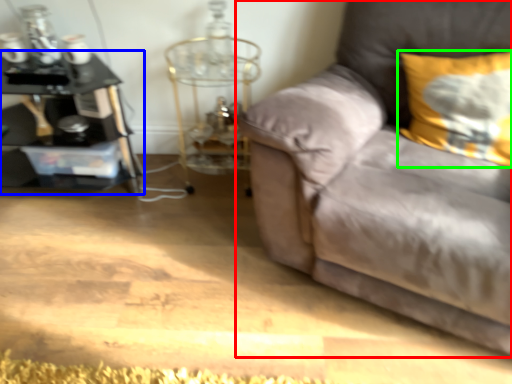
Question: Estimate the real-world distances between objects in this image. Which object is farther from studio couch (highlighted by a red box), table (highlighted by a blue box) or pillow (highlighted by a green box)?

Choices:
 (A) table
 (B) pillow

Answer: (A)